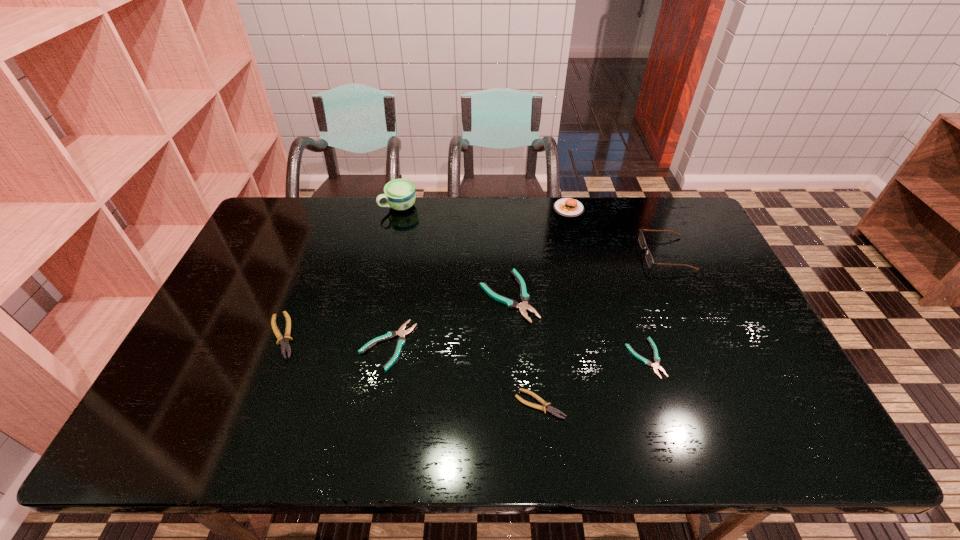
Where is `vacant space located 0.120m on the right of the second smallest teal pliers`? vacant space located 0.120m on the right of the second smallest teal pliers is located at coordinates pos(460,345).

This screenshot has height=540, width=960. Find the location of `vacant point located 0.110m on the left of the nearest pliers`. vacant point located 0.110m on the left of the nearest pliers is located at coordinates (468, 404).

In order to click on free location located 0.320m on the back of the rightmost pliers in this screenshot , I will do `click(612, 258)`.

Locate an element on the screen. Image resolution: width=960 pixels, height=540 pixels. cup present at the far edge is located at coordinates (400, 195).

Image resolution: width=960 pixels, height=540 pixels. Find the location of `spectacles present at the far edge`. spectacles present at the far edge is located at coordinates (649, 259).

Identify the location of food that is positioned at the far edge. (567, 207).

Locate an element on the screen. Image resolution: width=960 pixels, height=540 pixels. object present at the near edge is located at coordinates (549, 409).

Where is `object that is at the right edge`? object that is at the right edge is located at coordinates (649, 259).

Where is `object at the far right corner`? This screenshot has width=960, height=540. object at the far right corner is located at coordinates (649, 259).

Where is `vacant region at the far edge of the desktop`? vacant region at the far edge of the desktop is located at coordinates (472, 226).